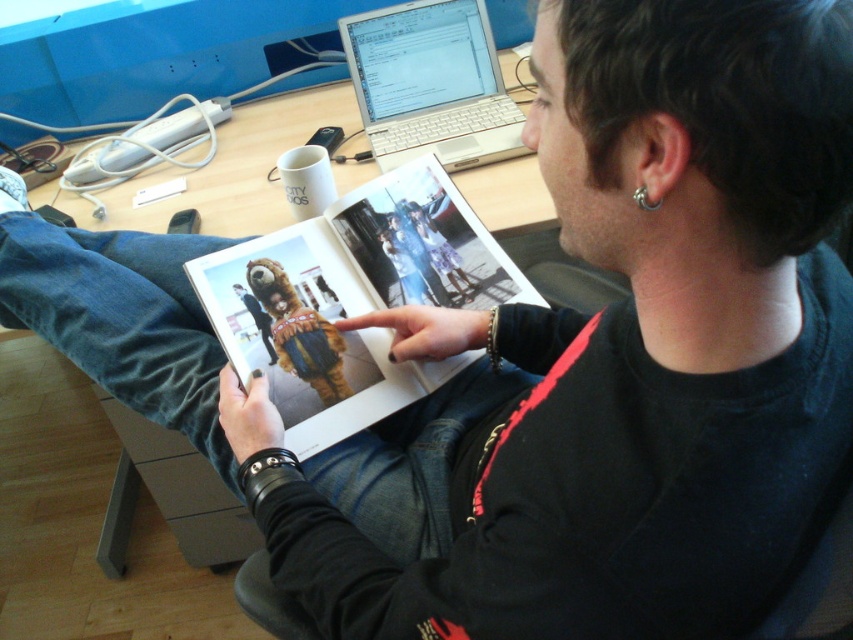
Question: Can you confirm if silver metallic laptop at upper center is positioned to the left of silver metallic ring at ear?

Choices:
 (A) no
 (B) yes

Answer: (B)

Question: Based on their relative distances, which object is farther from the matte paper magazine at center?

Choices:
 (A) silver metallic laptop at upper center
 (B) silver metallic ring at ear

Answer: (B)

Question: Which point appears closest to the camera in this image?

Choices:
 (A) (238, 266)
 (B) (659, 433)
 (C) (428, 99)

Answer: (B)

Question: Among these points, which one is farthest from the camera?

Choices:
 (A) (387, 45)
 (B) (811, 296)
 (C) (209, 227)
 (D) (642, 188)

Answer: (A)

Question: Can you confirm if matte paper magazine at center is wider than wooden at upper center?

Choices:
 (A) no
 (B) yes

Answer: (A)

Question: Does black leather jacket at upper center have a smaller size compared to matte paper magazine at center?

Choices:
 (A) yes
 (B) no

Answer: (B)